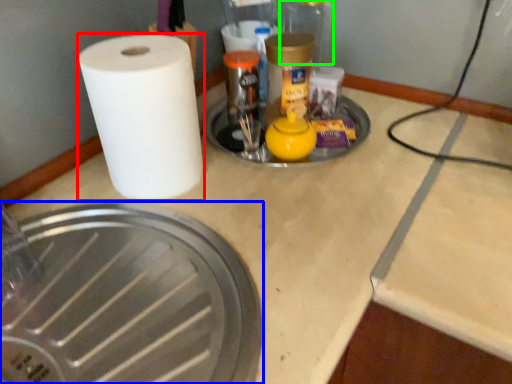
Question: Considering the real-world distances, which object is farthest from paper towel (highlighted by a red box)? manhole cover (highlighted by a blue box) or glass jar (highlighted by a green box)?

Choices:
 (A) manhole cover
 (B) glass jar

Answer: (B)